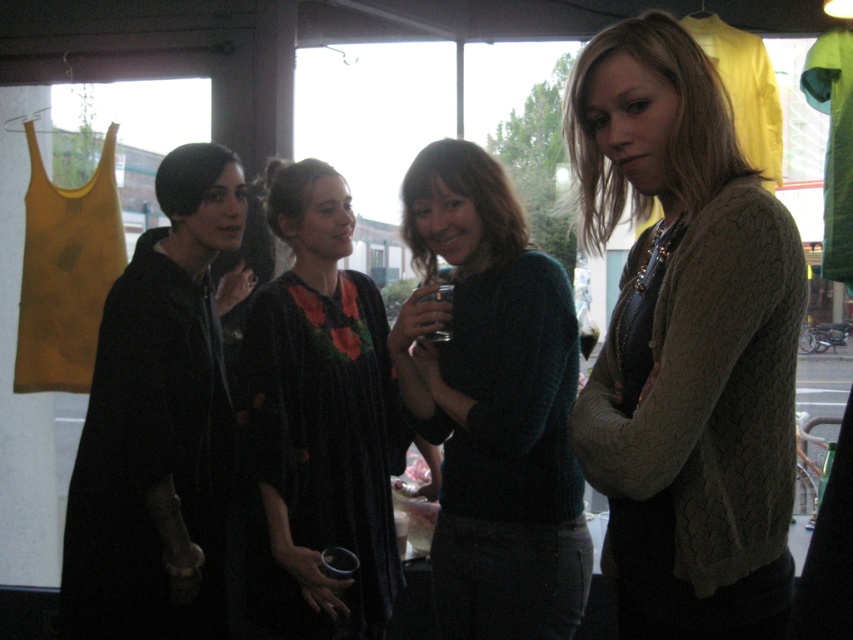
You are a store manager trying to arrange the garments in the store. You have a display rack that can only hold items with a width of 30 cm or less. The knitted teal sweater at center and the velvet black dress at center are both available for display. Can both items be placed on the rack?

The knitted teal sweater at center has a larger width than the velvet black dress at center. Since the rack can only hold items up to 30 cm wide, we need to check both widths. If the sweater exceeds 30 cm, it can be excluded, but the dress might still fit. However, without exact measurements, we can only confirm the dress is narrower than the sweater, but cannot determine if either meets the 30 cm limit.

You are a store employee arranging items on a display rack. You need to place both the knitted teal sweater at center and the velvet black dress at center. According to the image, which item is placed on top of the other?

The knitted teal sweater at center is positioned over the velvet black dress at center, so it is placed on top of the velvet black dress at center.